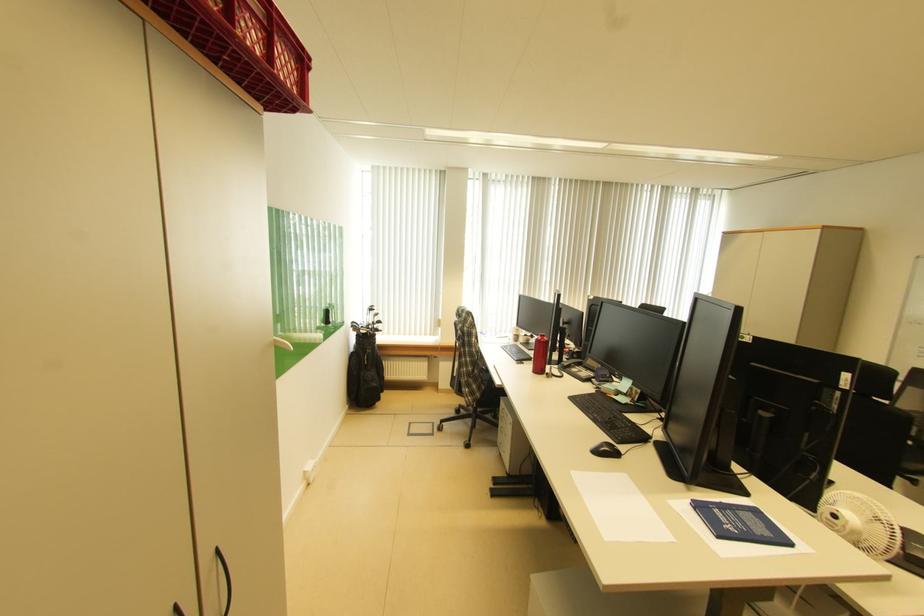
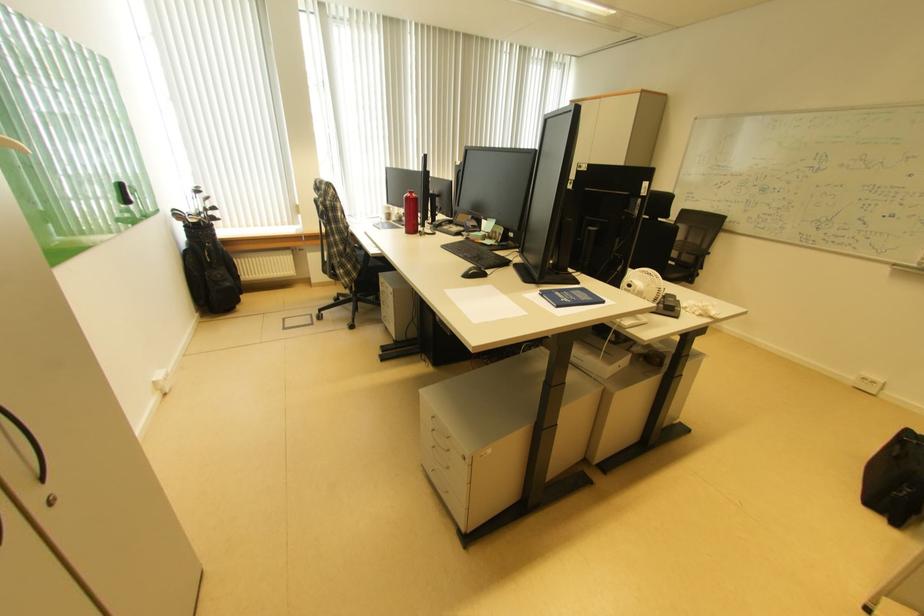
Find the pixel in the second image that matches [845,514] in the first image.

(639, 284)